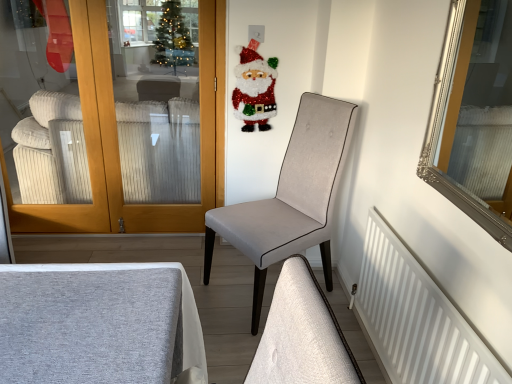
Question: Considering the relative sizes of light gray fabric chair at center and glittery santa claus at upper center in the image provided, is light gray fabric chair at center thinner than glittery santa claus at upper center?

Choices:
 (A) no
 (B) yes

Answer: (A)

Question: Is light gray fabric chair at center outside of glittery santa claus at upper center?

Choices:
 (A) no
 (B) yes

Answer: (B)

Question: Can you confirm if light gray fabric chair at center is smaller than glittery santa claus at upper center?

Choices:
 (A) yes
 (B) no

Answer: (B)

Question: Can you confirm if light gray fabric chair at center is wider than glittery santa claus at upper center?

Choices:
 (A) yes
 (B) no

Answer: (A)

Question: Is light gray fabric chair at center taller than glittery santa claus at upper center?

Choices:
 (A) no
 (B) yes

Answer: (B)

Question: From a real-world perspective, relative to white ribbed fabric couch at left, is white matte radiator at lower right vertically above or below?

Choices:
 (A) above
 (B) below

Answer: (B)

Question: From the image's perspective, is white matte radiator at lower right positioned above or below white ribbed fabric couch at left?

Choices:
 (A) above
 (B) below

Answer: (B)

Question: Looking at their shapes, would you say white matte radiator at lower right is wider or thinner than white ribbed fabric couch at left?

Choices:
 (A) wide
 (B) thin

Answer: (B)

Question: Is point (410, 294) positioned closer to the camera than point (170, 120)?

Choices:
 (A) farther
 (B) closer

Answer: (B)

Question: Choose the correct answer: Is glittery santa claus at upper center inside white matte radiator at lower right or outside it?

Choices:
 (A) outside
 (B) inside

Answer: (A)

Question: Is glittery santa claus at upper center to the left or to the right of white matte radiator at lower right in the image?

Choices:
 (A) right
 (B) left

Answer: (B)

Question: Is point (272, 84) closer or farther from the camera than point (473, 377)?

Choices:
 (A) closer
 (B) farther

Answer: (B)

Question: From the image's perspective, relative to white matte radiator at lower right, is glittery santa claus at upper center above or below?

Choices:
 (A) below
 (B) above

Answer: (B)

Question: In terms of width, does white matte radiator at lower right look wider or thinner when compared to glittery santa claus at upper center?

Choices:
 (A) thin
 (B) wide

Answer: (B)

Question: Is point (357, 299) positioned closer to the camera than point (261, 59)?

Choices:
 (A) closer
 (B) farther

Answer: (A)